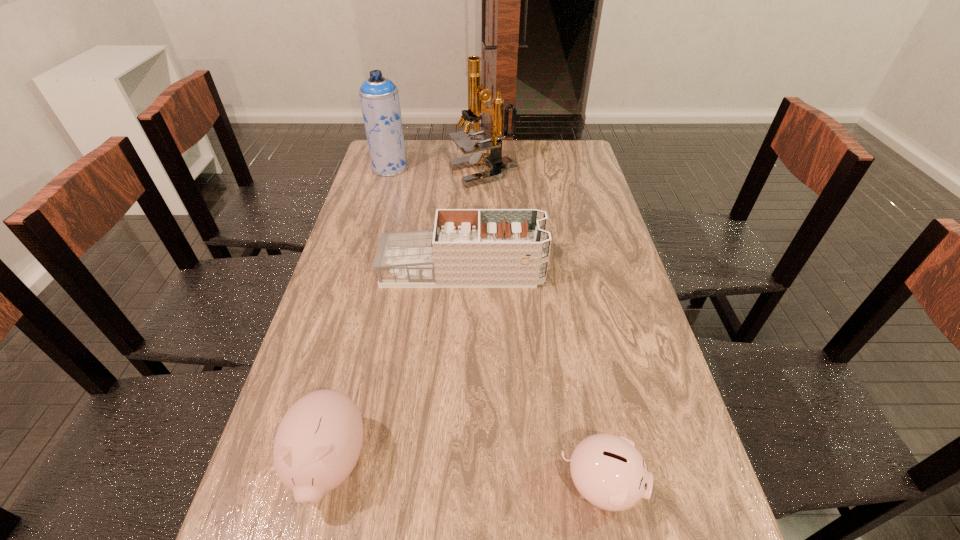
This screenshot has height=540, width=960. I want to click on microscope, so click(477, 95).

You are a GUI agent. You are given a task and a screenshot of the screen. Output one action in this format:
    pyautogui.click(x=<x>, y=<y>)
    Task: Click on the aerosol can
    
    Given the screenshot: What is the action you would take?
    pyautogui.click(x=379, y=98)

The image size is (960, 540). In order to click on the third nearest object in this screenshot , I will do `click(468, 248)`.

Locate an element on the screen. the left piggy bank is located at coordinates pos(318,442).

Find the location of `the shortest object`. the shortest object is located at coordinates (609, 472).

I want to click on the shorter piggy bank, so click(x=609, y=472).

Where is `free space located 0.100m at the eyepiece of the microscope`? The width and height of the screenshot is (960, 540). free space located 0.100m at the eyepiece of the microscope is located at coordinates (422, 173).

Where is `free space located 0.060m at the eyepiece of the microscope`? free space located 0.060m at the eyepiece of the microscope is located at coordinates (433, 173).

Find the location of a particular element. vacant region located 0.180m at the eyepiece of the microscope is located at coordinates (401, 173).

Where is `vacant region located on the front of the aerosol can`? This screenshot has height=540, width=960. vacant region located on the front of the aerosol can is located at coordinates (381, 200).